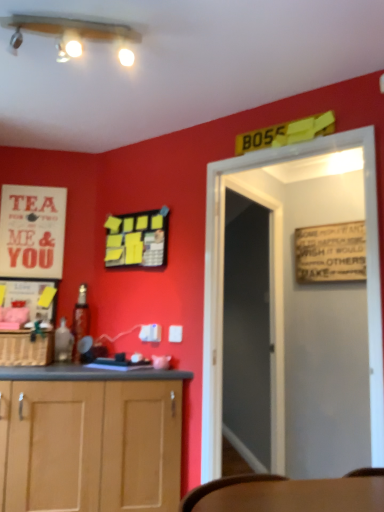
Locate an element on the screen. This screenshot has width=384, height=512. vacant space situated above matte white lights at upper center (from a real-world perspective) is located at coordinates (82, 16).